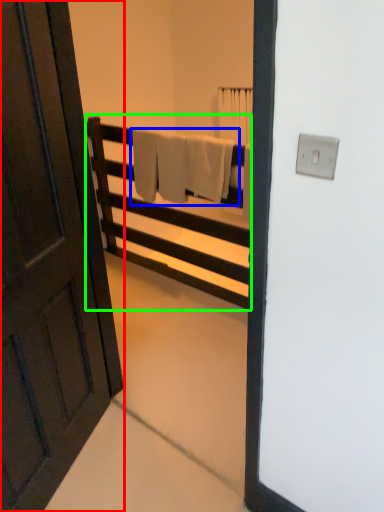
Question: Based on their relative distances, which object is nearer to door (highlighted by a red box)? Choose from bath towel (highlighted by a blue box) and furniture (highlighted by a green box).

Choices:
 (A) bath towel
 (B) furniture

Answer: (A)